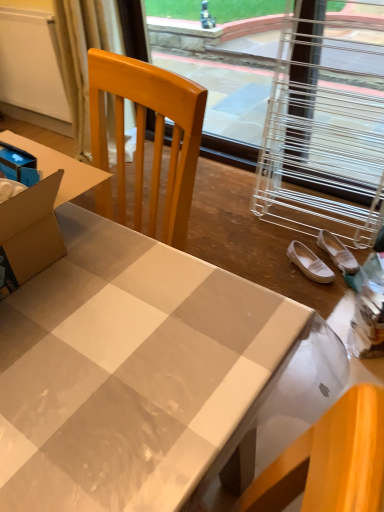
Question: Can we say white suede shoes at lower right, marked as the 1th footwear in a left-to-right arrangement, lies outside white glossy desk at center?

Choices:
 (A) yes
 (B) no

Answer: (A)

Question: Considering the relative positions of white suede shoes at lower right, which is counted as the 2th footwear, starting from the right, and white glossy desk at center in the image provided, is white suede shoes at lower right, which is counted as the 2th footwear, starting from the right, in front of white glossy desk at center?

Choices:
 (A) yes
 (B) no

Answer: (B)

Question: Can you confirm if white suede shoes at lower right, which is counted as the 2th footwear, starting from the right, is smaller than white glossy desk at center?

Choices:
 (A) no
 (B) yes

Answer: (B)

Question: Is white suede shoes at lower right, which is counted as the 2th footwear, starting from the right, at the right side of white glossy desk at center?

Choices:
 (A) yes
 (B) no

Answer: (A)

Question: Is white suede shoes at lower right, marked as the 1th footwear in a left-to-right arrangement, thinner than white glossy desk at center?

Choices:
 (A) yes
 (B) no

Answer: (A)

Question: Choose the correct answer: Is white suede shoes at lower right, marked as the 1th footwear in a left-to-right arrangement, inside white fabric shoe at lower right, which ranks as the 1th footwear in right-to-left order, or outside it?

Choices:
 (A) inside
 (B) outside

Answer: (B)

Question: Relative to white fabric shoe at lower right, marked as the second footwear in a left-to-right arrangement, is white suede shoes at lower right, marked as the 1th footwear in a left-to-right arrangement, in front or behind?

Choices:
 (A) front
 (B) behind

Answer: (A)

Question: Based on their positions, is white suede shoes at lower right, which is counted as the 2th footwear, starting from the right, located to the left or right of white fabric shoe at lower right, which ranks as the 1th footwear in right-to-left order?

Choices:
 (A) left
 (B) right

Answer: (A)

Question: Looking at their shapes, would you say white suede shoes at lower right, which is counted as the 2th footwear, starting from the right, is wider or thinner than white fabric shoe at lower right, marked as the second footwear in a left-to-right arrangement?

Choices:
 (A) thin
 (B) wide

Answer: (B)

Question: Considering their positions, is white fabric shoe at lower right, marked as the second footwear in a left-to-right arrangement, located in front of or behind beige fabric curtain at upper left?

Choices:
 (A) behind
 (B) front

Answer: (B)

Question: From the image's perspective, is white fabric shoe at lower right, marked as the second footwear in a left-to-right arrangement, positioned above or below beige fabric curtain at upper left?

Choices:
 (A) above
 (B) below

Answer: (B)

Question: Based on their sizes in the image, would you say white fabric shoe at lower right, marked as the second footwear in a left-to-right arrangement, is bigger or smaller than beige fabric curtain at upper left?

Choices:
 (A) big
 (B) small

Answer: (B)

Question: In the image, is white fabric shoe at lower right, which ranks as the 1th footwear in right-to-left order, on the left side or the right side of beige fabric curtain at upper left?

Choices:
 (A) left
 (B) right

Answer: (B)

Question: Is white fabric shoe at lower right, marked as the second footwear in a left-to-right arrangement, taller or shorter than metallic wire at upper right?

Choices:
 (A) short
 (B) tall

Answer: (A)

Question: Considering the positions of white fabric shoe at lower right, which ranks as the 1th footwear in right-to-left order, and metallic wire at upper right in the image, is white fabric shoe at lower right, which ranks as the 1th footwear in right-to-left order, wider or thinner than metallic wire at upper right?

Choices:
 (A) thin
 (B) wide

Answer: (A)